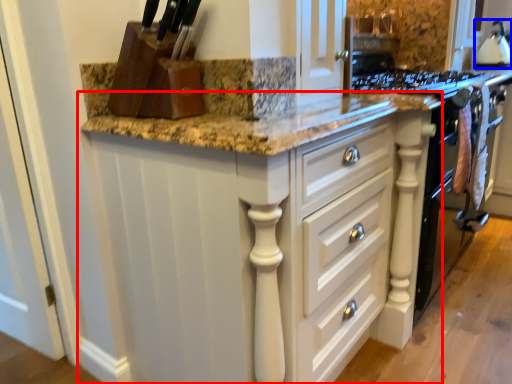
Question: Which object is further to the camera taking this photo, cabinetry (highlighted by a red box) or kitchen appliance (highlighted by a blue box)?

Choices:
 (A) cabinetry
 (B) kitchen appliance

Answer: (B)